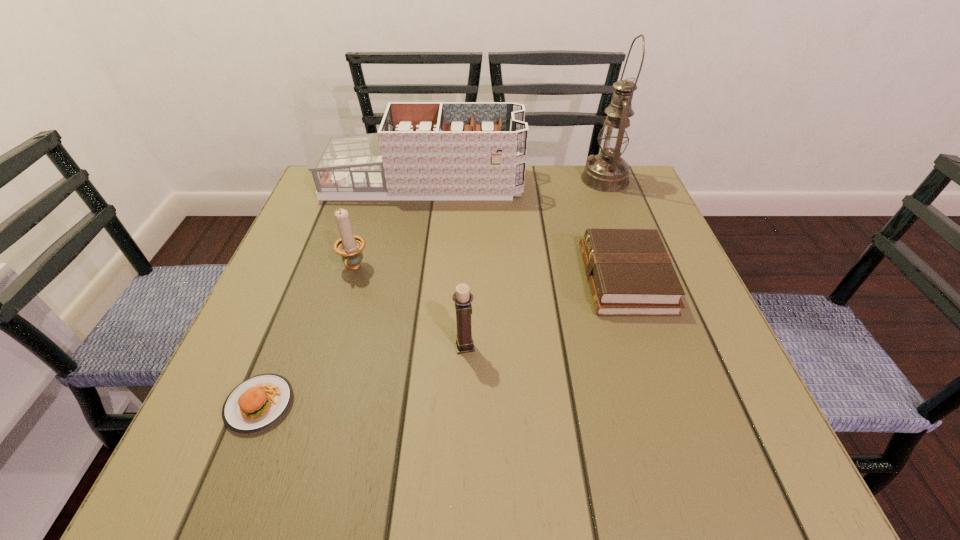
The width and height of the screenshot is (960, 540). I want to click on vacant space situated on the back of the nearer candle_holder, so click(468, 256).

Identify the location of vacant space located on the handle side of the left candle_holder. (298, 457).

The height and width of the screenshot is (540, 960). I want to click on vacant space positioned 0.380m on the spine side of the second shortest object, so pyautogui.click(x=399, y=279).

I want to click on free region located 0.290m on the spine side of the second shortest object, so click(444, 279).

Where is `free space located on the spine side of the second shortest object`? free space located on the spine side of the second shortest object is located at coordinates (546, 279).

Image resolution: width=960 pixels, height=540 pixels. Identify the location of vacant area situated 0.120m on the back of the shortest object. (293, 321).

This screenshot has height=540, width=960. What are the coordinates of `oil lamp that is at the far edge` in the screenshot? It's located at (607, 172).

At what (x,y) coordinates should I click in order to perform the action: click on dollhouse positioned at the far edge. Please return your answer as a coordinate pair (x, y). Looking at the image, I should click on (423, 150).

Locate an element on the screen. object at the near edge is located at coordinates (257, 403).

The height and width of the screenshot is (540, 960). In order to click on dollhouse at the left edge in this screenshot , I will do `click(423, 150)`.